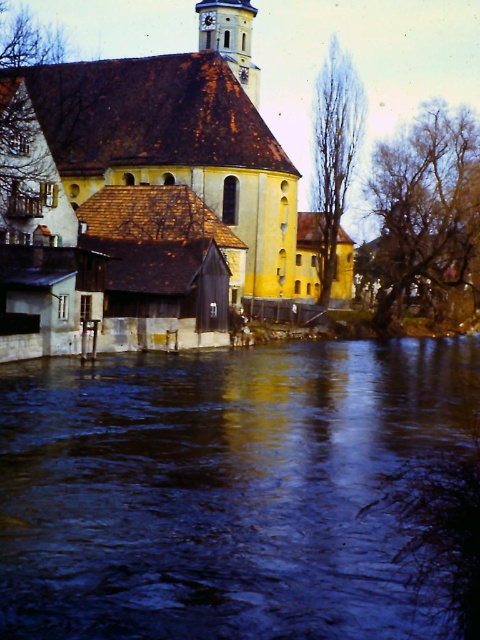
Question: Which point is closer to the camera?

Choices:
 (A) white stucco clock tower at upper center
 (B) yellow matte church at center

Answer: (B)

Question: Is blue water at center further to the viewer compared to white stucco clock tower at upper center?

Choices:
 (A) yes
 (B) no

Answer: (B)

Question: Considering the real-world distances, which object is closest to the white stucco clock tower at upper center?

Choices:
 (A) yellow matte church at center
 (B) blue water at center

Answer: (A)

Question: Is yellow matte church at center bigger than white stucco clock tower at upper center?

Choices:
 (A) no
 (B) yes

Answer: (B)

Question: Is yellow matte church at center bigger than white stucco clock tower at upper center?

Choices:
 (A) yes
 (B) no

Answer: (A)

Question: Which object appears farthest from the camera in this image?

Choices:
 (A) white stucco clock tower at upper center
 (B) blue water at center

Answer: (A)